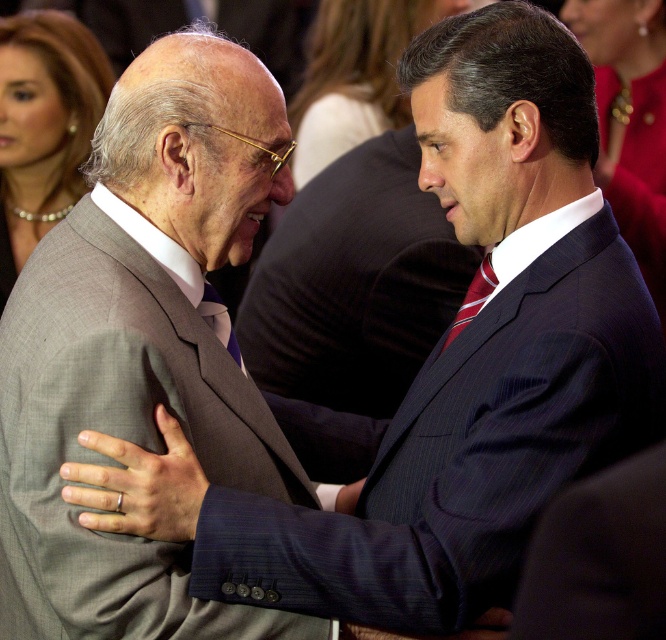
Question: Which object is positioned closest to the dark blue pinstripe suit at center?

Choices:
 (A) blue striped tie at center
 (B) striped silk tie at center

Answer: (B)

Question: Considering the relative positions of gray suit at left and blue striped tie at center in the image provided, where is gray suit at left located with respect to blue striped tie at center?

Choices:
 (A) below
 (B) above

Answer: (A)

Question: Which point is farther to the camera?

Choices:
 (A) (216, 124)
 (B) (486, 284)
 (C) (220, 339)
 (D) (250, 349)

Answer: (D)

Question: Observing the image, what is the correct spatial positioning of gray suit at left in reference to blue striped tie at center?

Choices:
 (A) below
 (B) above

Answer: (A)

Question: Which of the following is the closest to the observer?

Choices:
 (A) (406, 269)
 (B) (59, 445)

Answer: (B)

Question: Where is striped silk tie at center located in relation to blue striped tie at center in the image?

Choices:
 (A) right
 (B) left

Answer: (A)